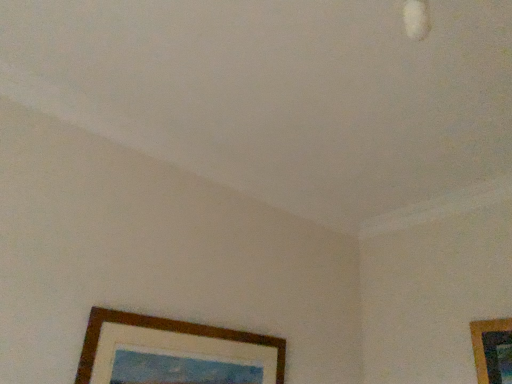
In order to face brown wooden picture frame at lower left, should I rotate leftwards or rightwards?

Rotate left and turn 7.655 degrees.

At what (x,y) coordinates should I click in order to perform the action: click on brown wooden picture frame at lower left. Please return your answer as a coordinate pair (x, y). This screenshot has height=384, width=512. Looking at the image, I should click on (174, 352).

What do you see at coordinates (174, 352) in the screenshot? The image size is (512, 384). I see `brown wooden picture frame at lower left` at bounding box center [174, 352].

The image size is (512, 384). I want to click on brown wooden picture frame at lower left, so click(x=174, y=352).